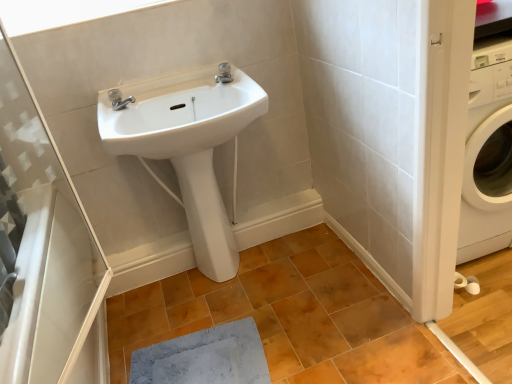
Locate an element on the screen. The width and height of the screenshot is (512, 384). white glossy bidet at center is located at coordinates (206, 216).

The height and width of the screenshot is (384, 512). I want to click on satin nickel faucet at upper center, marked as the 2th tap in a bottom-to-top arrangement, so click(x=224, y=73).

What do you see at coordinates (62, 12) in the screenshot? I see `white matte window at upper left` at bounding box center [62, 12].

This screenshot has width=512, height=384. Identify the location of white glossy sink at upper center. (180, 113).

Locate an element on the screen. polished chrome faucet at upper center, arranged as the second tap when viewed from the right is located at coordinates (119, 99).

In order to click on blue soft mat at lower center in this screenshot , I will do `click(204, 357)`.

How different are the orientations of transparent plastic shower door at left and blue soft mat at lower center in degrees?

transparent plastic shower door at left and blue soft mat at lower center are facing 3.15 degrees away from each other.

Can you confirm if transparent plastic shower door at left is wider than blue soft mat at lower center?

No, transparent plastic shower door at left is not wider than blue soft mat at lower center.

Does transparent plastic shower door at left have a lesser height compared to blue soft mat at lower center?

In fact, transparent plastic shower door at left may be taller than blue soft mat at lower center.

Is brown matte tile at center not near polished chrome faucet at upper center, placed as the first tap when sorted from left to right?

Indeed, brown matte tile at center is not near polished chrome faucet at upper center, placed as the first tap when sorted from left to right.

Does brown matte tile at center turn towards polished chrome faucet at upper center, placed as the first tap when sorted from left to right?

No, brown matte tile at center does not turn towards polished chrome faucet at upper center, placed as the first tap when sorted from left to right.

Considering the positions of objects brown matte tile at center and polished chrome faucet at upper center, the 2th tap positioned from the top, in the image provided, who is behind, brown matte tile at center or polished chrome faucet at upper center, the 2th tap positioned from the top,?

polished chrome faucet at upper center, the 2th tap positioned from the top, is behind.

Measure the distance from brown matte tile at center to polished chrome faucet at upper center, placed as the first tap when sorted from left to right.

brown matte tile at center and polished chrome faucet at upper center, placed as the first tap when sorted from left to right, are 3.36 feet apart.

Which is more to the left, white matte window at upper left or white glossy sink at upper center?

white matte window at upper left.

From the image's perspective, which one is positioned lower, white matte window at upper left or white glossy sink at upper center?

From the image's view, white glossy sink at upper center is below.

Consider the image. Between white matte window at upper left and white glossy sink at upper center, which one has smaller width?

white matte window at upper left is thinner.

Considering the positions of objects white matte window at upper left and white glossy sink at upper center in the image provided, who is behind, white matte window at upper left or white glossy sink at upper center?

white matte window at upper left.

Is polished chrome faucet at upper center, the first tap from the bottom, not within white matte window at upper left?

Yes, polished chrome faucet at upper center, the first tap from the bottom, is outside of white matte window at upper left.

Is polished chrome faucet at upper center, arranged as the second tap when viewed from the right, facing towards white matte window at upper left?

No, polished chrome faucet at upper center, arranged as the second tap when viewed from the right, is not oriented towards white matte window at upper left.

Which is more to the right, polished chrome faucet at upper center, the first tap from the bottom, or white matte window at upper left?

polished chrome faucet at upper center, the first tap from the bottom, is more to the right.

From a real-world perspective, who is located higher, polished chrome faucet at upper center, the first tap from the bottom, or white matte window at upper left?

white matte window at upper left.

In the scene shown: From the image's perspective, is polished chrome faucet at upper center, placed as the first tap when sorted from left to right, positioned above or below white glossy bidet at center?

From the image's perspective, polished chrome faucet at upper center, placed as the first tap when sorted from left to right, appears above white glossy bidet at center.

Consider the image. Is polished chrome faucet at upper center, placed as the first tap when sorted from left to right, spatially inside white glossy bidet at center, or outside of it?

polished chrome faucet at upper center, placed as the first tap when sorted from left to right, cannot be found inside white glossy bidet at center.

Based on the photo, does polished chrome faucet at upper center, the first tap from the bottom, have a larger size compared to white glossy bidet at center?

Actually, polished chrome faucet at upper center, the first tap from the bottom, might be smaller than white glossy bidet at center.

You are a GUI agent. You are given a task and a screenshot of the screen. Output one action in this format:
    pyautogui.click(x=<x>, y=<y>)
    Task: Click on the bidet behind the polished chrome faucet at upper center, the first tap from the bottom
    
    Given the screenshot: What is the action you would take?
    pyautogui.click(x=206, y=216)

Is blue soft mat at lower center to the right of transparent plastic shower door at left from the viewer's perspective?

Yes.

How many degrees apart are the facing directions of blue soft mat at lower center and transparent plastic shower door at left?

There is a 3.15-degree angle between the facing directions of blue soft mat at lower center and transparent plastic shower door at left.

You are a GUI agent. You are given a task and a screenshot of the screen. Output one action in this format:
    pyautogui.click(x=<x>, y=<y>)
    Task: Click on the doormat on the right side of transparent plastic shower door at left
    
    Given the screenshot: What is the action you would take?
    pyautogui.click(x=204, y=357)

From the image's perspective, is white matte window at upper left located beneath polished chrome faucet at upper center, placed as the first tap when sorted from left to right?

Incorrect, from the image's perspective, white matte window at upper left is higher than polished chrome faucet at upper center, placed as the first tap when sorted from left to right.

Looking at this image, between white matte window at upper left and polished chrome faucet at upper center, arranged as the second tap when viewed from the right, which one appears on the left side from the viewer's perspective?

From the viewer's perspective, white matte window at upper left appears more on the left side.

Is white matte window at upper left not near polished chrome faucet at upper center, placed as the first tap when sorted from left to right?

white matte window at upper left is near polished chrome faucet at upper center, placed as the first tap when sorted from left to right, not far away.

Considering the points (40, 8) and (123, 107), which point is in front, point (40, 8) or point (123, 107)?

The point (123, 107) is in front.

Where is `doormat below the transparent plastic shower door at left (from the image's perspective)`? This screenshot has height=384, width=512. doormat below the transparent plastic shower door at left (from the image's perspective) is located at coordinates (204, 357).

Where is `the 2nd tap to the left of the brown matte tile at center, starting your count from the anchor`? the 2nd tap to the left of the brown matte tile at center, starting your count from the anchor is located at coordinates (119, 99).

Considering their positions, is satin nickel faucet at upper center, which is the 1th tap in right-to-left order, positioned closer to white glossy sink at upper center than white glossy bidet at center?

Among the two, satin nickel faucet at upper center, which is the 1th tap in right-to-left order, is located nearer to white glossy sink at upper center.

From the picture: When comparing their distances from white glossy bidet at center, does blue soft mat at lower center or polished chrome faucet at upper center, the 2th tap positioned from the top, seem closer?

blue soft mat at lower center lies closer to white glossy bidet at center than the other object.

In the scene shown: Estimate the real-world distances between objects in this image. Which object is closer to white glossy sink at upper center, polished chrome faucet at upper center, the 2th tap positioned from the top, or white matte window at upper left?

polished chrome faucet at upper center, the 2th tap positioned from the top, is positioned closer to the anchor white glossy sink at upper center.

Which object lies further to the anchor point white matte window at upper left, white glossy bidet at center or brown matte tile at center?

brown matte tile at center is further to white matte window at upper left.

When comparing their distances from transparent plastic shower door at left, does blue soft mat at lower center or brown matte tile at center seem further?

brown matte tile at center is positioned further to the anchor transparent plastic shower door at left.

Consider the image. Estimate the real-world distances between objects in this image. Which object is further from blue soft mat at lower center, polished chrome faucet at upper center, arranged as the second tap when viewed from the right, or satin nickel faucet at upper center, marked as the 1th tap in a top-to-bottom arrangement?

Based on the image, satin nickel faucet at upper center, marked as the 1th tap in a top-to-bottom arrangement, appears to be further to blue soft mat at lower center.

From the image, which object appears to be nearer to blue soft mat at lower center, brown matte tile at center or transparent plastic shower door at left?

brown matte tile at center.

Based on their spatial positions, is brown matte tile at center or polished chrome faucet at upper center, the first tap from the bottom, further from white matte window at upper left?

The object further to white matte window at upper left is brown matte tile at center.

Where is `shower door between polished chrome faucet at upper center, the first tap from the bottom, and blue soft mat at lower center in the up-down direction`? The height and width of the screenshot is (384, 512). shower door between polished chrome faucet at upper center, the first tap from the bottom, and blue soft mat at lower center in the up-down direction is located at coordinates (x=45, y=249).

This screenshot has height=384, width=512. In order to click on shower door between polished chrome faucet at upper center, the 2th tap positioned from the top, and brown matte tile at center vertically in this screenshot , I will do `click(45, 249)`.

The image size is (512, 384). I want to click on sink between white matte window at upper left and satin nickel faucet at upper center, which is the 1th tap in right-to-left order, in the horizontal direction, so click(180, 113).

At what (x,y) coordinates should I click in order to perform the action: click on sink between polished chrome faucet at upper center, placed as the first tap when sorted from left to right, and transparent plastic shower door at left in the up-down direction. Please return your answer as a coordinate pair (x, y). This screenshot has width=512, height=384. Looking at the image, I should click on (180, 113).